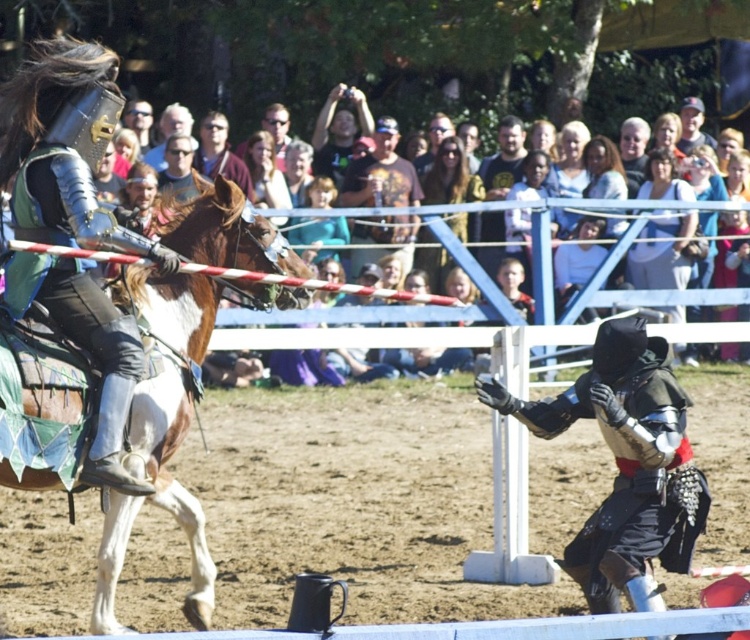
From the picture: You are a spectator at the medieval tournament and want to know which of the two points, point (156, 328) or point (350, 179), is closer to you. Based on their positions, which point is nearer?

Point (156, 328) is in front of point (350, 179), so it is closer to you.

You are a spectator at the event and want to take a photo of both the shiny black armor at center and the brown glossy horse at left. Can you see both objects in your camera frame at the same time?

The brown glossy horse at left is behind shiny black armor at center, so the horse may be partially or fully obscured by the armor, making it difficult to capture both in the same frame.